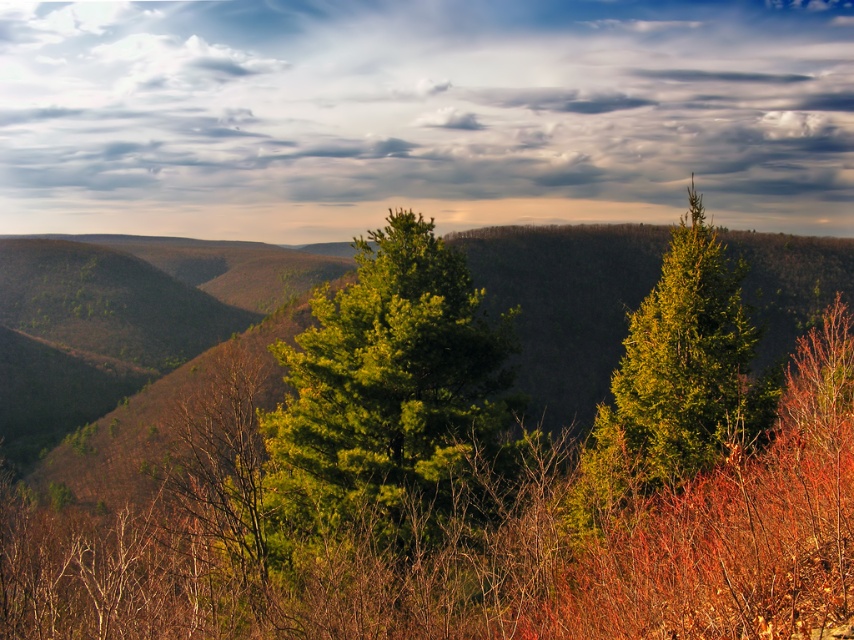
You are standing in the landscape scene. There is a point marked at coordinates point (x=420, y=115). What is the object located at this point?

The cloudy sky at upper center is located at point (x=420, y=115).